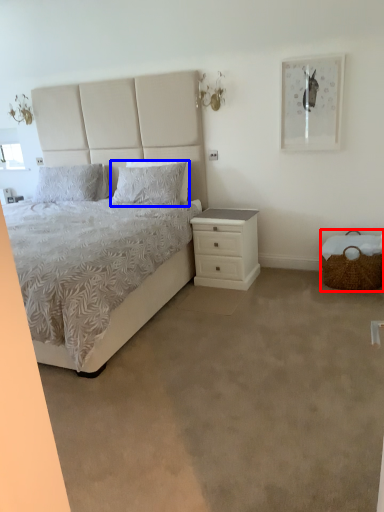
Question: Which object appears closest to the camera in this image, basket (highlighted by a red box) or pillow (highlighted by a blue box)?

Choices:
 (A) basket
 (B) pillow

Answer: (A)